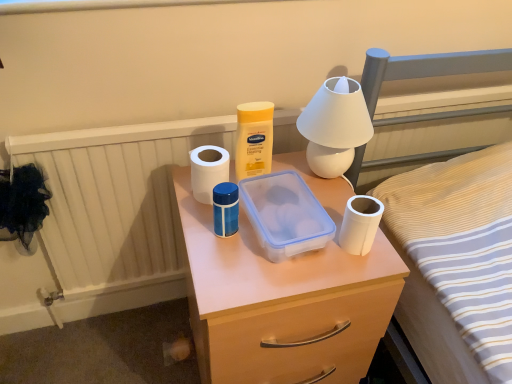
Question: Is translucent plastic container at center further to the viewer compared to transparent plastic container at center?

Choices:
 (A) no
 (B) yes

Answer: (A)

Question: Is the depth of translucent plastic container at center less than that of transparent plastic container at center?

Choices:
 (A) no
 (B) yes

Answer: (B)

Question: Is translucent plastic container at center aimed at transparent plastic container at center?

Choices:
 (A) no
 (B) yes

Answer: (A)

Question: Is translucent plastic container at center placed right next to transparent plastic container at center?

Choices:
 (A) no
 (B) yes

Answer: (A)

Question: Is transparent plastic container at center located within translucent plastic container at center?

Choices:
 (A) yes
 (B) no

Answer: (B)

Question: Considering their positions, is yellow plastic container at center located in front of or behind translucent plastic container at center?

Choices:
 (A) behind
 (B) front

Answer: (A)

Question: From a real-world perspective, relative to translucent plastic container at center, is yellow plastic container at center vertically above or below?

Choices:
 (A) below
 (B) above

Answer: (B)

Question: Is yellow plastic container at center taller or shorter than translucent plastic container at center?

Choices:
 (A) tall
 (B) short

Answer: (B)

Question: Would you say yellow plastic container at center is inside or outside translucent plastic container at center?

Choices:
 (A) inside
 (B) outside

Answer: (B)

Question: Considering the positions of white matte toilet paper at center, arranged as the second toilet paper when viewed from the right, and yellow plastic container at center in the image, is white matte toilet paper at center, arranged as the second toilet paper when viewed from the right, bigger or smaller than yellow plastic container at center?

Choices:
 (A) big
 (B) small

Answer: (B)

Question: Which is correct: white matte toilet paper at center, placed as the second toilet paper when sorted from front to back, is inside yellow plastic container at center, or outside of it?

Choices:
 (A) outside
 (B) inside

Answer: (A)

Question: Is point (205, 180) closer or farther from the camera than point (239, 145)?

Choices:
 (A) closer
 (B) farther

Answer: (A)

Question: In terms of height, does white matte toilet paper at center, placed as the second toilet paper when sorted from front to back, look taller or shorter compared to yellow plastic container at center?

Choices:
 (A) short
 (B) tall

Answer: (A)

Question: Visually, is translucent plastic container at center positioned to the left or to the right of yellow plastic container at center?

Choices:
 (A) left
 (B) right

Answer: (B)

Question: Relative to yellow plastic container at center, is translucent plastic container at center in front or behind?

Choices:
 (A) front
 (B) behind

Answer: (A)